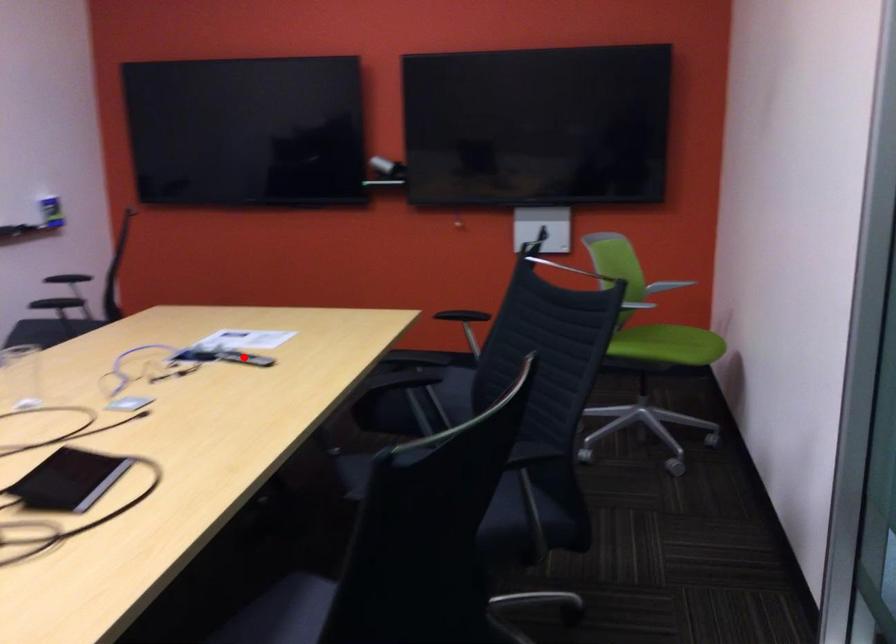
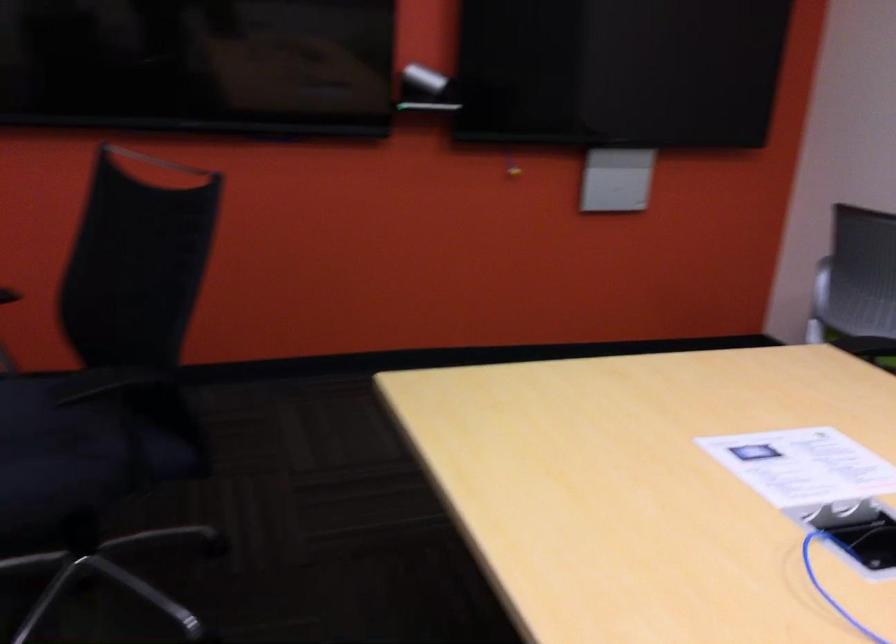
Question: I am providing you with two images of the same scene from different viewpoints. In image1, a red point is highlighted. Considering the same 3D point in image2, which of the following is correct?

Choices:
 (A) It is closer
 (B) It is farther

Answer: (A)